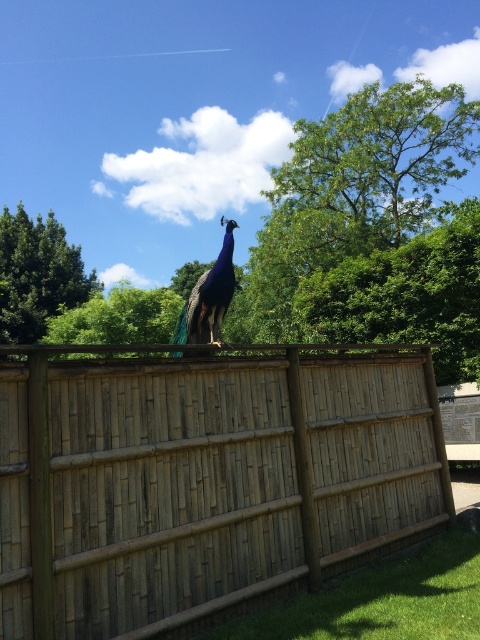
You are a birdwatcher observing the peacock on the wooden fence. You notice two green leafy trees in the background. Which tree, the green leafy tree at upper center or the green leafy tree at upper left, is taller?

The green leafy tree at upper left is taller than the green leafy tree at upper center because the green leafy tree at upper center is not as tall as green leafy tree at upper left.

You are standing in the park where the peacock is perched on the wooden fence. There are two points marked on the fence. One is at coordinate point (285,438) and the other is at coordinate point (41,237). Which point is closer to you?

Point (285,438) is closer to the camera than point (41,237).